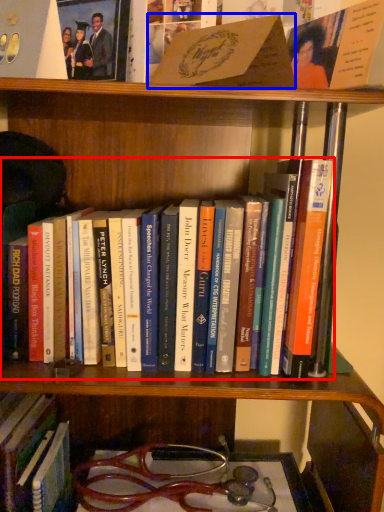
Question: Among these objects, which one is nearest to the camera, book (highlighted by a red box) or book (highlighted by a blue box)?

Choices:
 (A) book
 (B) book

Answer: (B)